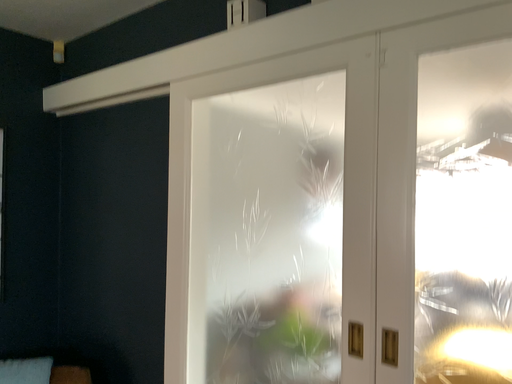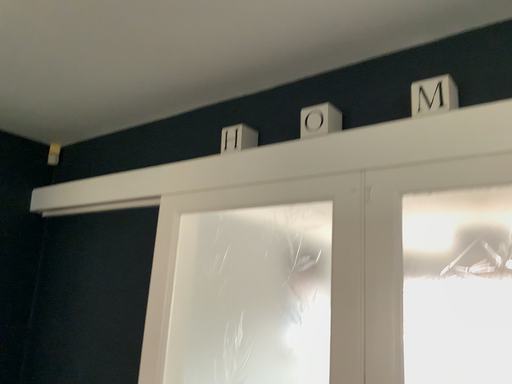
Question: How did the camera likely rotate when shooting the video?

Choices:
 (A) rotated downward
 (B) rotated upward

Answer: (B)